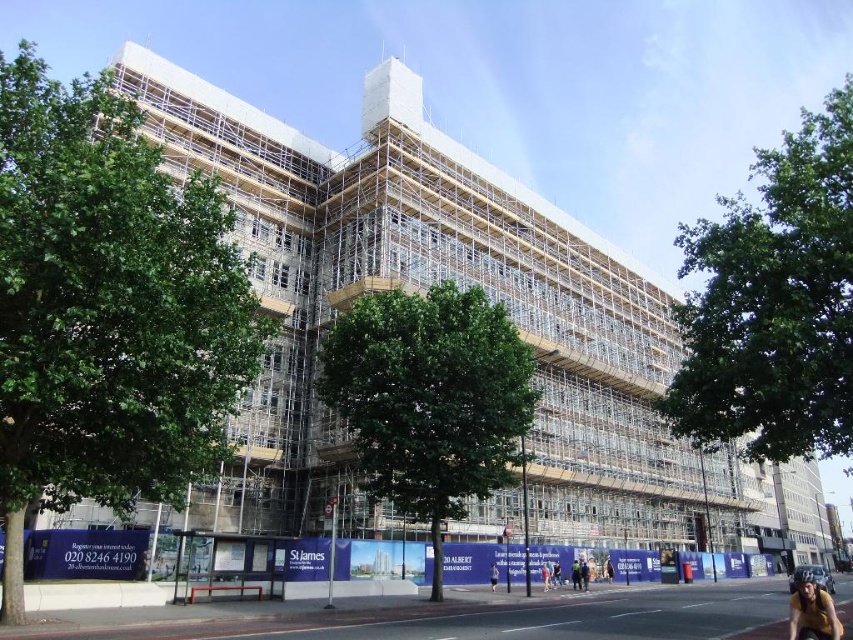
You are a city planner evaluating the construction site. You notice the green leafy tree at left and the green leafy tree at center. Which tree would require more space for its root system based on their sizes?

The green leafy tree at left is bigger than the green leafy tree at center, so it would require more space for its root system.

You are a pedestrian walking along the sidewalk and see the white scaffolding at center and the green leafy tree at left. Which object is closer to the ground?

The white scaffolding at center is closer to the ground because it is below the green leafy tree at left.

You are a pedestrian walking along the sidewalk and see both the green leafy tree at left and the green leafy tree at center. Which tree is closer to you as you walk past them?

The green leafy tree at left is closer to you because it is positioned in front of the green leafy tree at center.